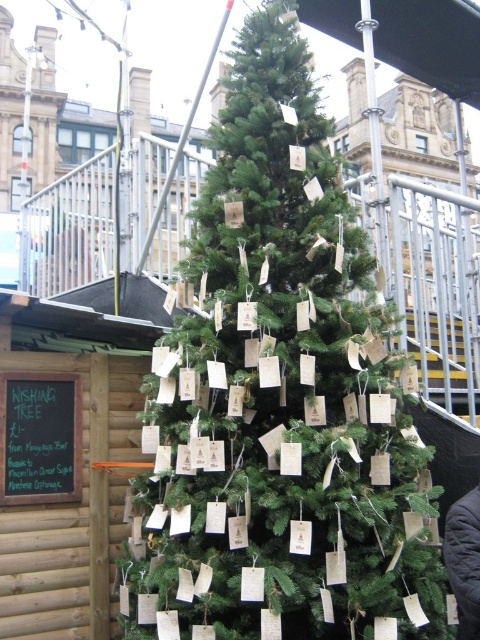
Question: Can you confirm if green matte christmas tree at center is thinner than black chalkboard at left?

Choices:
 (A) yes
 (B) no

Answer: (B)

Question: Does green matte christmas tree at center appear under black chalkboard at left?

Choices:
 (A) no
 (B) yes

Answer: (A)

Question: Is the position of green matte christmas tree at center less distant than that of black chalkboard at left?

Choices:
 (A) yes
 (B) no

Answer: (A)

Question: Which point is farther from the camera taking this photo?

Choices:
 (A) (72, 392)
 (B) (141, 602)

Answer: (A)